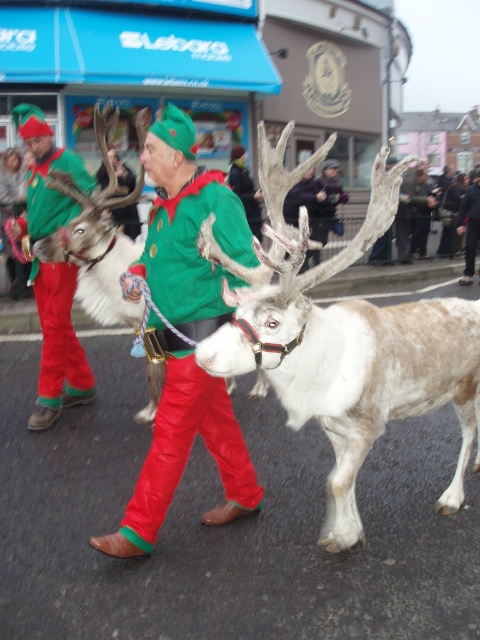
You are a photographer at the event. You want to take a photo of the matte green costume at center and the white speckled fur at center without any obstruction. Based on their positions, which one should you focus on first to ensure both are visible?

The white speckled fur at center is in front of the matte green costume at center, so you should focus on the matte green costume at center first to ensure it is visible behind the white speckled fur at center.

You are a photographer trying to capture the reindeer and the elf in the scene. Based on their positions, which object is closer to the camera? Please choose between the white speckled fur at center and the matte green costume at center.

The white speckled fur at center is below the matte green costume at center, so the matte green costume at center is closer to the camera.

You are a photographer trying to capture the white speckled fur at center in the image. Where exactly should you focus your camera to ensure you capture it perfectly?

You should focus your camera at point coordinates (343,340) to capture the white speckled fur at center.